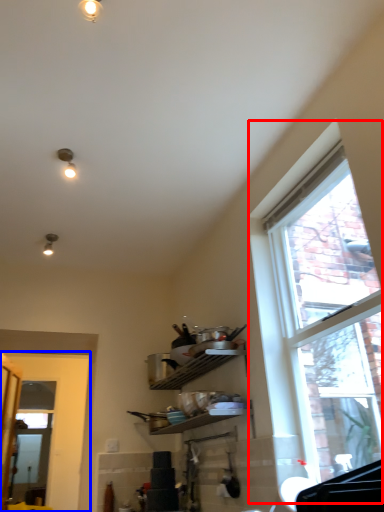
Question: Which of the following is the farthest to the observer, window (highlighted by a red box) or door (highlighted by a blue box)?

Choices:
 (A) window
 (B) door

Answer: (B)